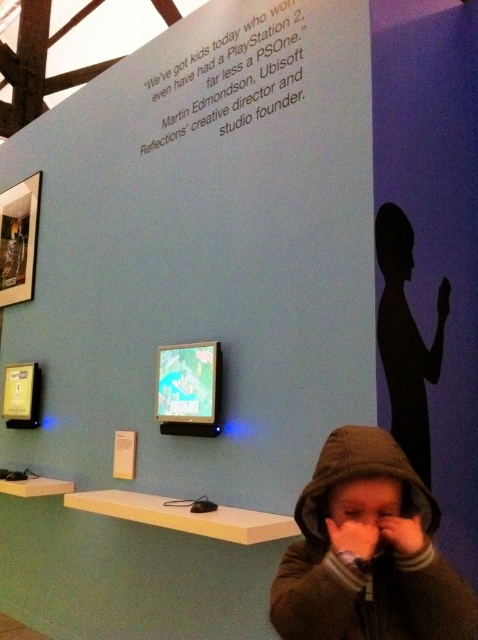
Question: Which point is farther from the camera taking this photo?

Choices:
 (A) (369, 520)
 (B) (412, 611)
 (C) (391, 326)

Answer: (C)

Question: Based on their relative distances, which object is farther from the brown fleece hoodie at lower right?

Choices:
 (A) pink matte nose at center
 (B) black silhouette phone at right

Answer: (B)

Question: Can you confirm if brown fleece hoodie at lower right is positioned above black silhouette phone at right?

Choices:
 (A) no
 (B) yes

Answer: (A)

Question: Is the position of black silhouette phone at right less distant than that of pink matte nose at center?

Choices:
 (A) yes
 (B) no

Answer: (B)

Question: Is black silhouette phone at right further to the viewer compared to pink matte nose at center?

Choices:
 (A) yes
 (B) no

Answer: (A)

Question: Which of the following is the closest to the observer?

Choices:
 (A) black silhouette phone at right
 (B) pink matte nose at center
 (C) brown fleece hoodie at lower right

Answer: (C)